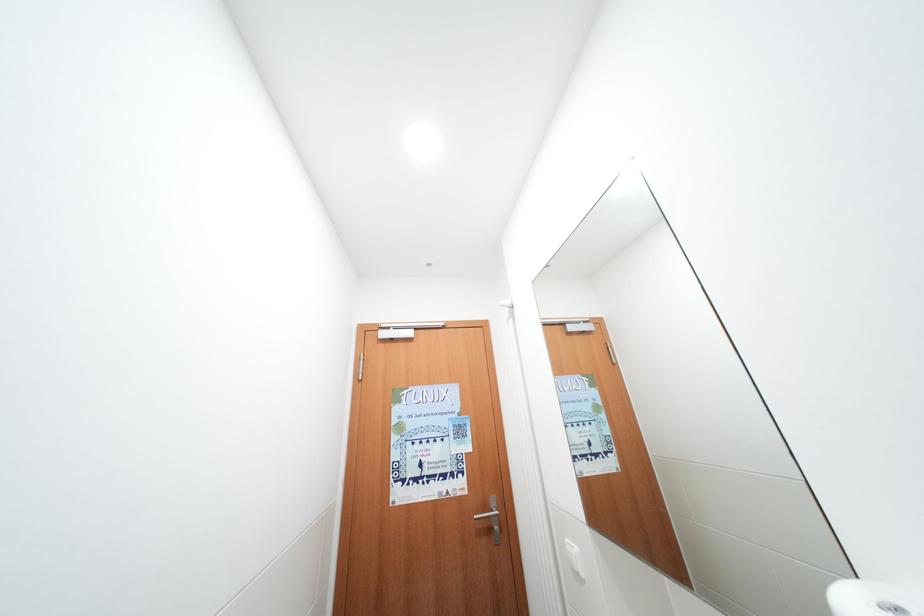
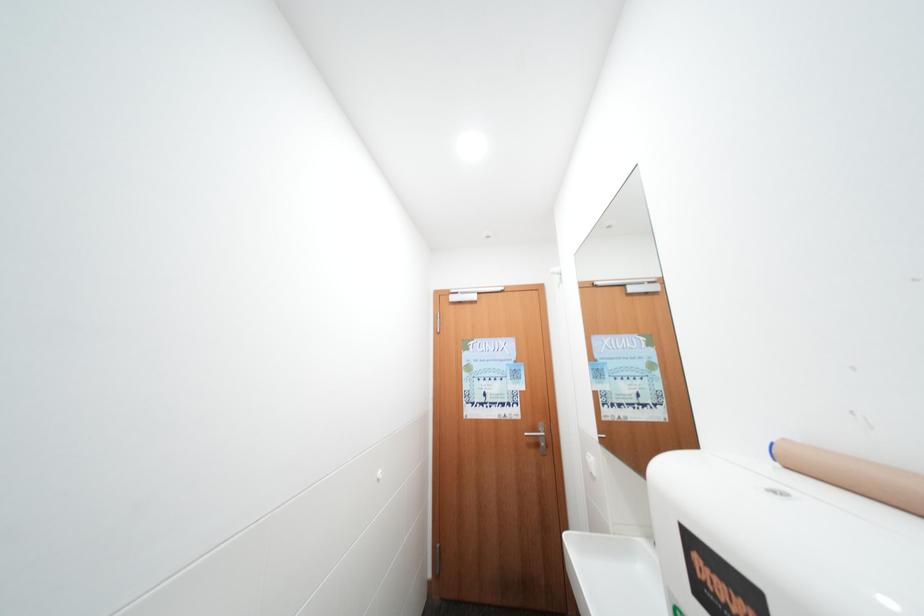
Question: The first image is from the beginning of the video and the second image is from the end. How did the camera likely rotate when shooting the video?

Choices:
 (A) Left
 (B) Right
 (C) Up
 (D) Down

Answer: (A)